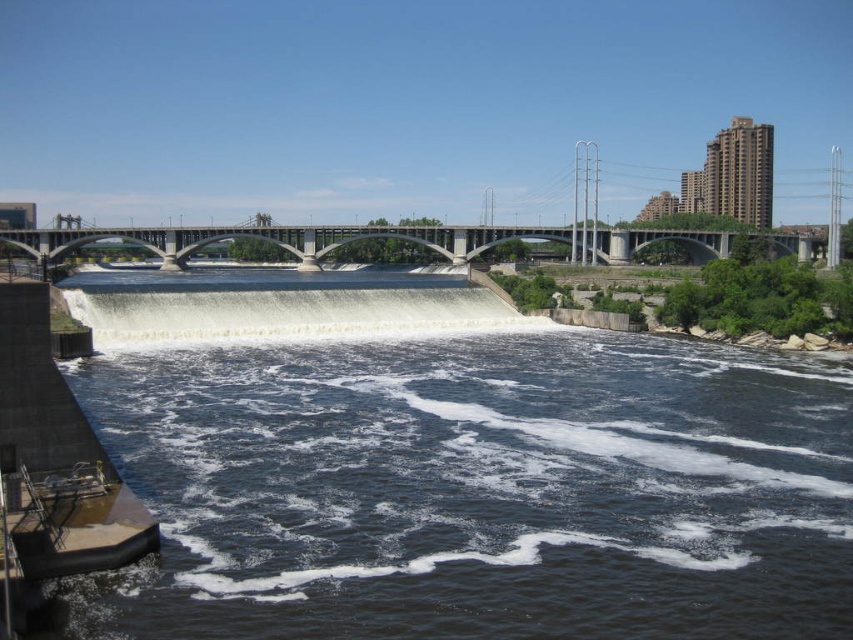
Question: Does dark blue water at lower left appear on the right side of concrete bridge at center?

Choices:
 (A) yes
 (B) no

Answer: (A)

Question: Which of the following is the closest to the observer?

Choices:
 (A) (550, 336)
 (B) (637, 250)

Answer: (A)

Question: Considering the relative positions of dark blue water at lower left and concrete bridge at center in the image provided, where is dark blue water at lower left located with respect to concrete bridge at center?

Choices:
 (A) below
 (B) above

Answer: (A)

Question: Does dark blue water at lower left have a lesser width compared to concrete bridge at center?

Choices:
 (A) yes
 (B) no

Answer: (A)